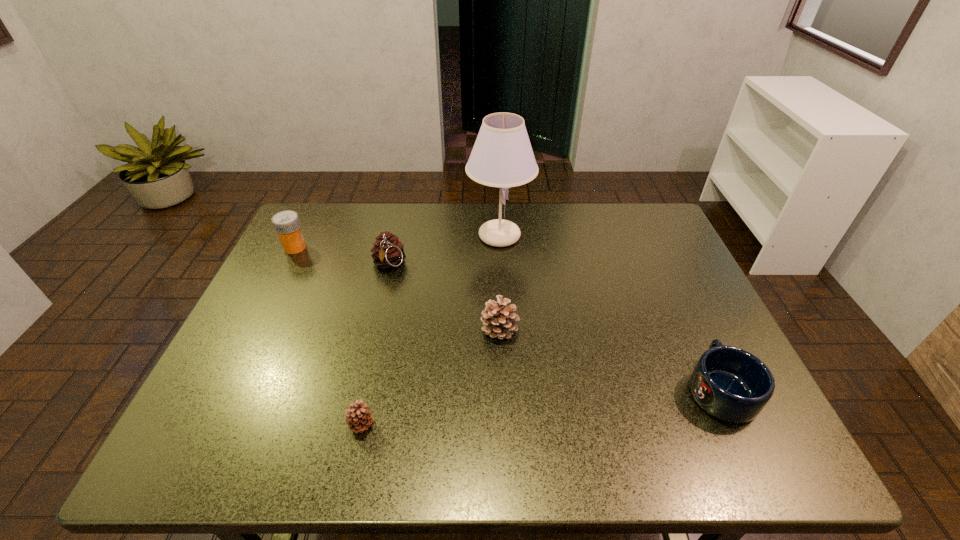
At what (x,y) coordinates should I click in order to perform the action: click on free location located on the left of the rightmost pinecone. Please return your answer as a coordinate pair (x, y). The height and width of the screenshot is (540, 960). Looking at the image, I should click on (383, 329).

Where is `vacant space located with the handle on the side of the rightmost object`? vacant space located with the handle on the side of the rightmost object is located at coordinates (667, 276).

At what (x,y) coordinates should I click in order to perform the action: click on vacant space located 0.100m with the handle on the side of the rightmost object. Please return your answer as a coordinate pair (x, y). Looking at the image, I should click on (690, 325).

The width and height of the screenshot is (960, 540). In order to click on vacant area situated 0.380m with the handle on the side of the rightmost object in this screenshot , I will do `click(657, 254)`.

In order to click on free space located 0.230m on the back of the shortest pinecone in this screenshot , I will do `click(382, 330)`.

Where is `lampshade located in the far edge section of the desktop`? Image resolution: width=960 pixels, height=540 pixels. lampshade located in the far edge section of the desktop is located at coordinates (502, 156).

Where is `medicine that is at the far edge`? medicine that is at the far edge is located at coordinates (286, 223).

At what (x,y) coordinates should I click in order to perform the action: click on mug present at the near edge. Please return your answer as a coordinate pair (x, y). The image size is (960, 540). Looking at the image, I should click on (731, 384).

You are a GUI agent. You are given a task and a screenshot of the screen. Output one action in this format:
    pyautogui.click(x=<x>, y=<y>)
    Task: Click on the pinecone that is at the near edge
    The width and height of the screenshot is (960, 540).
    Given the screenshot: What is the action you would take?
    click(358, 418)

Identify the location of object that is at the left edge. The width and height of the screenshot is (960, 540). (286, 223).